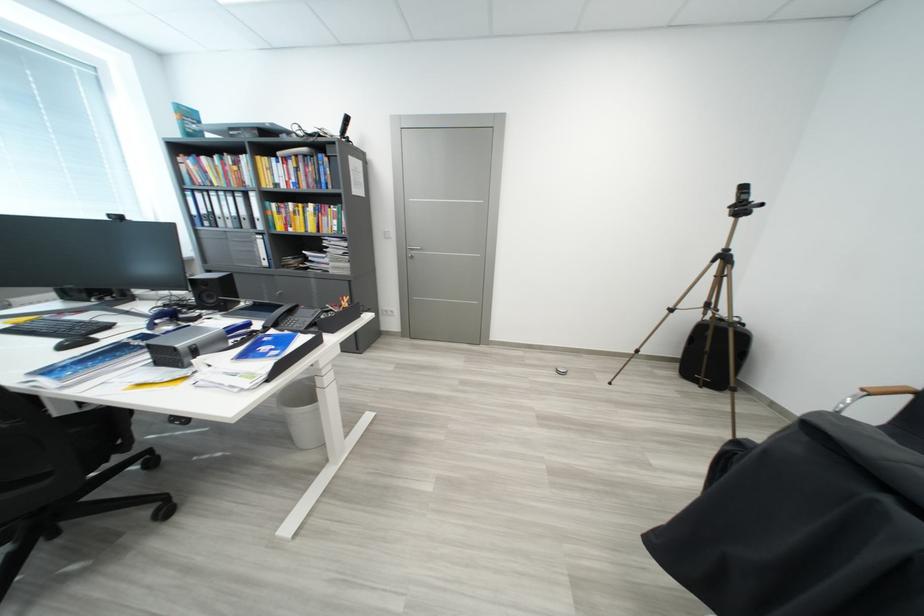
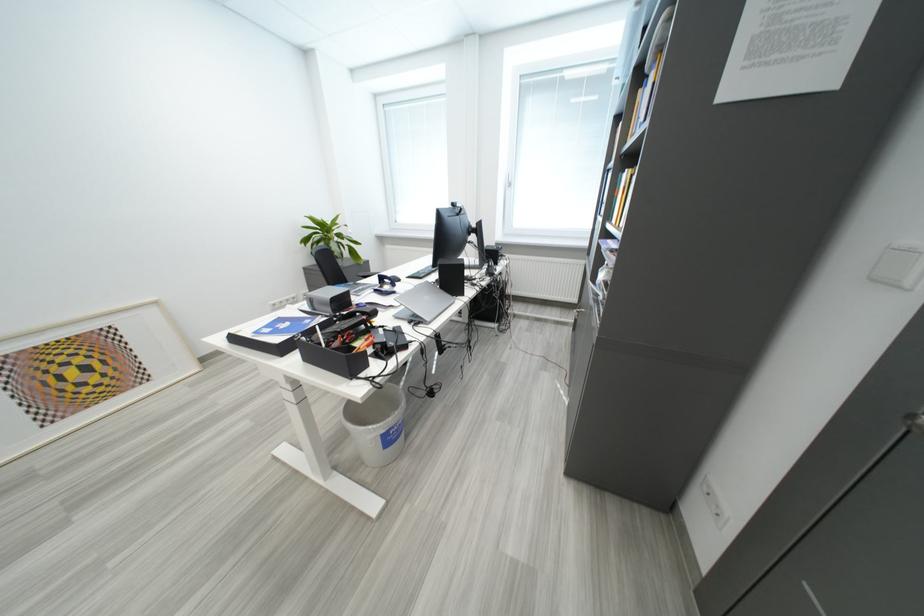
Where in the second image is the point corresponding to [274,342] from the first image?

(317, 323)